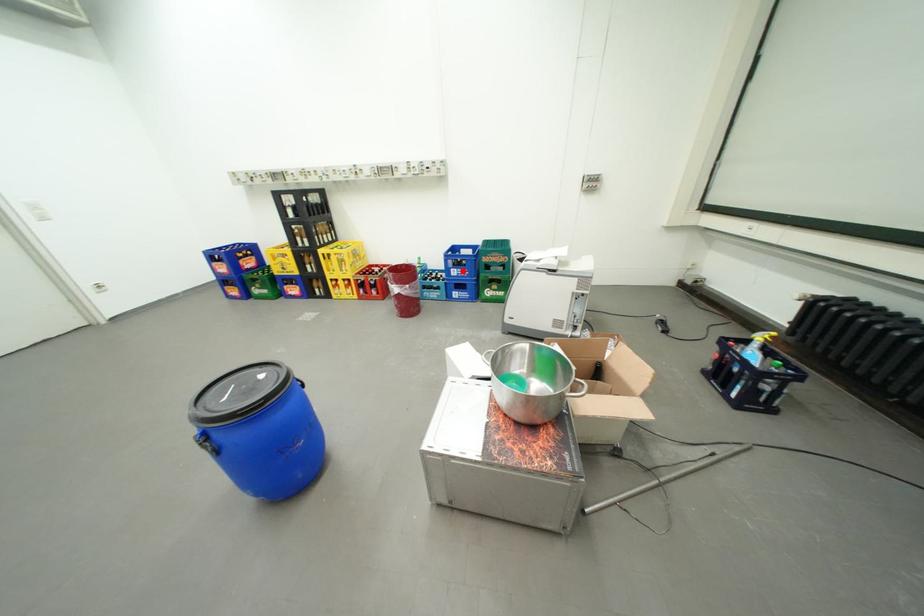
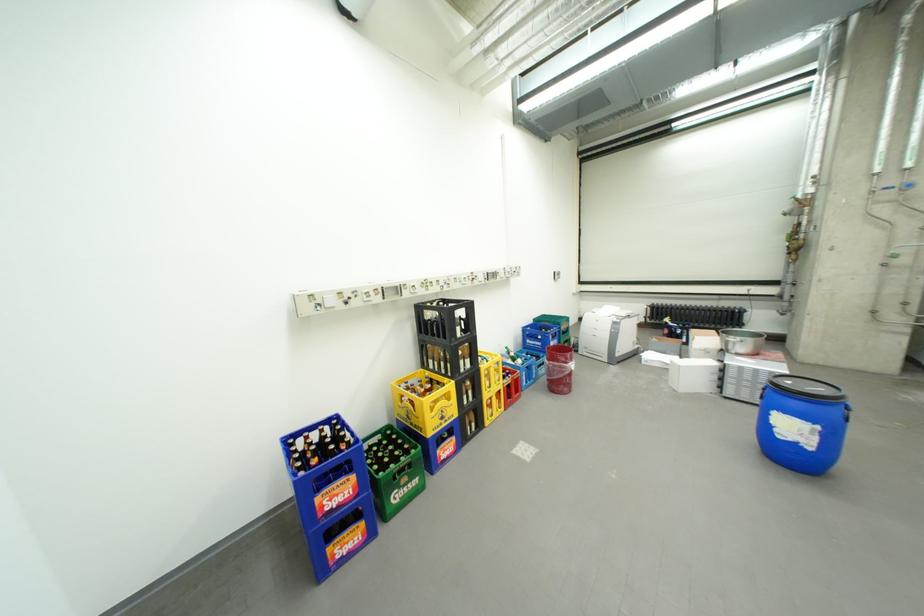
Locate, in the second image, the point that corresponds to the highlighted location in the first image.

(562, 344)